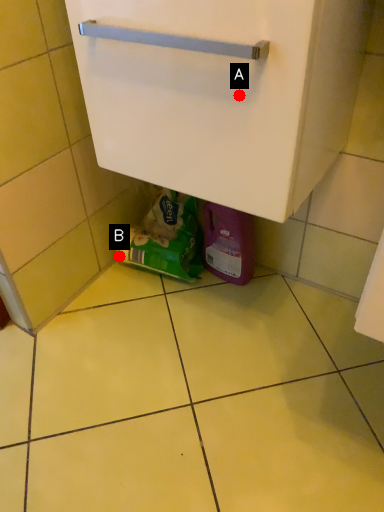
Question: Two points are circled on the image, labeled by A and B beside each circle. Which point is farther to the camera?

Choices:
 (A) A is further
 (B) B is further

Answer: (B)